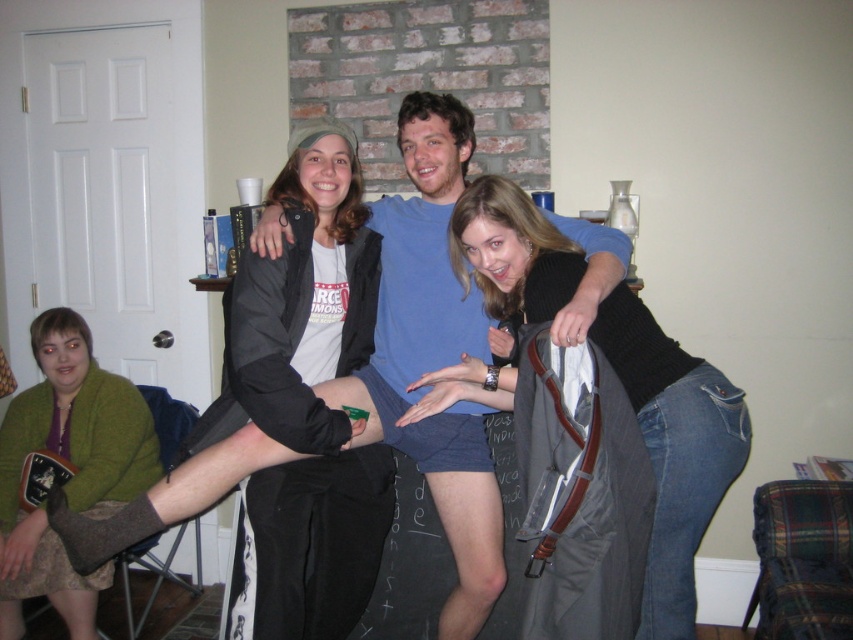
You are a photographer setting up a shoot in the living room. You need to ensure that the blue cotton shirt at center and jeans at center are visible in the frame. Based on their positions, which one should you focus on first to ensure both are in focus?

The blue cotton shirt at center is above jeans at center, so focusing on the blue cotton shirt at center first will ensure both are in focus since it is higher up and the jeans at center are below it.

You are standing in the living room and want to place a small plant between the two points labeled as point (624, 376) and point (85, 444). Based on their positions, which point should the plant be closer to in order to be centered between them?

The plant should be closer to point (85, 444) because point (624, 376) is in front of point (85, 444), meaning the center would be closer to the point further back.

You are standing in the living room and see two points marked in the scene. Which point is closer to you, point (381, 262) or point (526, 280)?

Point (381, 262) is closer to you because it is further to the viewer than point (526, 280).